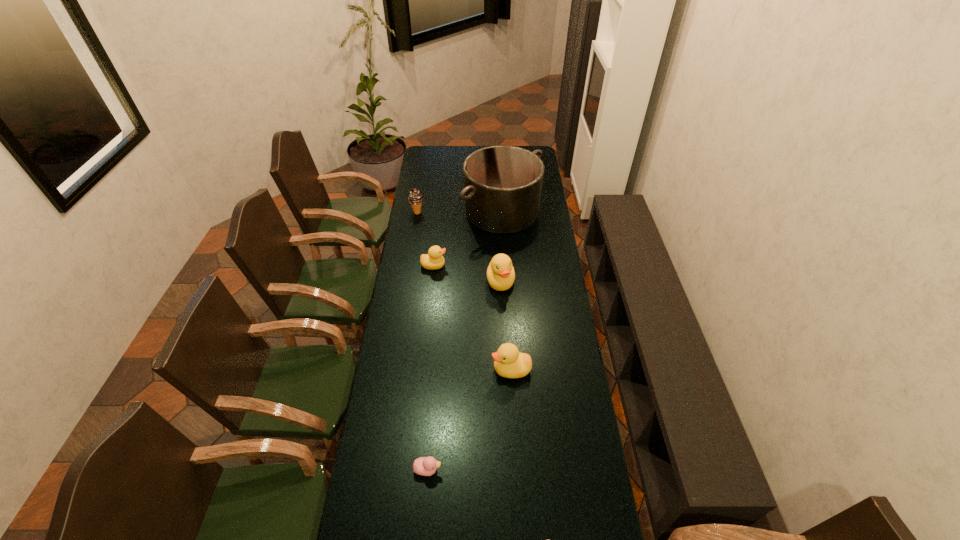
Where is `blank space located on the face of the biggest yellow duckling`? This screenshot has height=540, width=960. blank space located on the face of the biggest yellow duckling is located at coordinates (504, 365).

Locate an element on the screen. vacant area situated on the front of the leftmost object is located at coordinates (412, 242).

Where is `free space located on the face of the nearest yellow duckling`? The image size is (960, 540). free space located on the face of the nearest yellow duckling is located at coordinates (478, 369).

Where is `free space located on the face of the nearest yellow duckling`? The height and width of the screenshot is (540, 960). free space located on the face of the nearest yellow duckling is located at coordinates (400, 369).

Find the location of a particular element. free point located on the face of the nearest yellow duckling is located at coordinates (398, 369).

You are a GUI agent. You are given a task and a screenshot of the screen. Output one action in this format:
    pyautogui.click(x=<x>, y=<y>)
    Task: Click on the free space located 0.340m on the face of the leftmost yellow duckling
    The image size is (960, 540).
    Given the screenshot: What is the action you would take?
    pyautogui.click(x=520, y=265)

The width and height of the screenshot is (960, 540). Find the location of `free location located on the front-facing side of the second nearest duckling`. free location located on the front-facing side of the second nearest duckling is located at coordinates (530, 469).

Identify the location of icecream at the left edge. The image size is (960, 540). (415, 198).

Locate an element on the screen. object that is at the right edge is located at coordinates click(502, 184).

This screenshot has width=960, height=540. In the image, there is a desktop. Find the location of `vacant space at the far edge`. vacant space at the far edge is located at coordinates (456, 160).